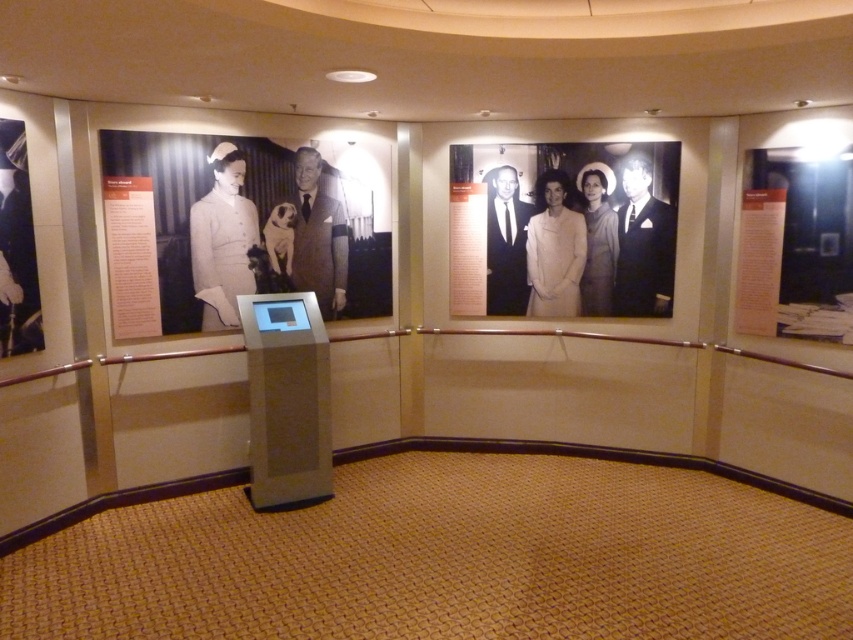
You are a visitor at the exhibit and want to take a photo of both the black suit at upper right and the white paper at right without cropping either. Based on their sizes, which object should you focus on to ensure both fit in the frame?

The black suit at upper right might be wider than the white paper at right, so focusing on the black suit at upper right would ensure both objects fit in the frame since it requires a wider angle.

From the picture: You are standing in the exhibit space and want to locate the black suit at upper right. According to the 2D coordinates provided, where should you look to find it?

The black suit at upper right is located at the 2D coordinates point (642,244).

You are a visitor at the exhibit and want to take a photo of both the black suit at upper right and the black suit at center in the same frame. Your camera has a maximum focus range of 60 centimeters. Can you capture both in one shot without moving your position?

The distance between the black suit at upper right and the black suit at center is 67.44 centimeters, which exceeds the camera maximum focus range of 60 centimeters. Therefore, you cannot capture both in one shot without moving your position.